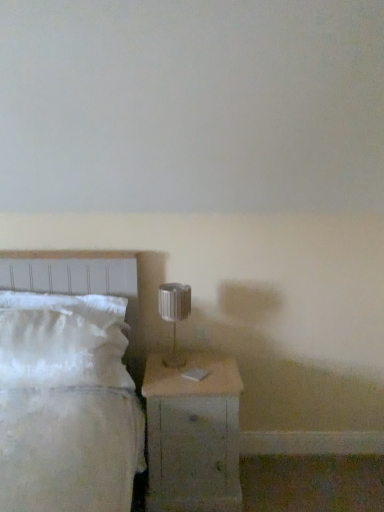
Looking at this image, in order to face white fluffy pillow at left, should I rotate leftwards or rightwards?

You should rotate left by 16.850 degrees.

Identify the location of white soft bed at left. (83, 284).

From the image's perspective, is wooden nightstand at lower right above or below white soft bed at left?

wooden nightstand at lower right is below white soft bed at left.

Can you confirm if wooden nightstand at lower right is positioned to the right of white soft bed at left?

Correct, you'll find wooden nightstand at lower right to the right of white soft bed at left.

Is wooden nightstand at lower right inside or outside of white soft bed at left?

The correct answer is: outside.

What are the coordinates of `bed above the wooden nightstand at lower right (from a real-world perspective)` in the screenshot? It's located at (83, 284).

Is white soft bed at left oriented towards metallic silver table lamp at center?

No, white soft bed at left is not facing towards metallic silver table lamp at center.

How distant is white soft bed at left from metallic silver table lamp at center?

A distance of 14.48 inches exists between white soft bed at left and metallic silver table lamp at center.

Can you confirm if white soft bed at left is bigger than metallic silver table lamp at center?

Indeed, white soft bed at left has a larger size compared to metallic silver table lamp at center.

From a real-world perspective, is white soft bed at left physically below metallic silver table lamp at center?

Yes, from a real-world perspective, white soft bed at left is beneath metallic silver table lamp at center.

Is metallic silver table lamp at center positioned in front of white soft bed at left?

That is False.

From a real-world perspective, is metallic silver table lamp at center located higher than white soft bed at left?

Yes, from a real-world perspective, metallic silver table lamp at center is on top of white soft bed at left.

Which of these two, metallic silver table lamp at center or white soft bed at left, is wider?

white soft bed at left.

Is white soft bed at left surrounded by metallic silver table lamp at center?

That's incorrect, white soft bed at left is not inside metallic silver table lamp at center.

Is there a large distance between white fluffy pillow at left and metallic silver table lamp at center?

No, white fluffy pillow at left is not far from metallic silver table lamp at center.

Considering the sizes of white fluffy pillow at left and metallic silver table lamp at center in the image, is white fluffy pillow at left wider or thinner than metallic silver table lamp at center?

Clearly, white fluffy pillow at left has more width compared to metallic silver table lamp at center.

From the image's perspective, is white fluffy pillow at left above or below metallic silver table lamp at center?

Clearly, from the image's perspective, white fluffy pillow at left is below metallic silver table lamp at center.

Is point (177, 372) closer to viewer compared to point (174, 364)?

Yes, it is.

Is wooden nightstand at lower right inside or outside of metallic silver table lamp at center?

wooden nightstand at lower right lies outside metallic silver table lamp at center.

Who is shorter, wooden nightstand at lower right or metallic silver table lamp at center?

metallic silver table lamp at center.

Which object is further away from the camera taking this photo, wooden nightstand at lower right or metallic silver table lamp at center?

metallic silver table lamp at center is behind.

Is point (194, 396) farther from camera compared to point (33, 385)?

That is True.

In the scene shown: Is wooden nightstand at lower right positioned with its back to white fluffy pillow at left?

wooden nightstand at lower right does not have its back to white fluffy pillow at left.

The height and width of the screenshot is (512, 384). In order to click on nightstand that is in front of the white fluffy pillow at left in this screenshot , I will do `click(193, 435)`.

From the image's perspective, which is above, wooden nightstand at lower right or white fluffy pillow at left?

From the image's view, white fluffy pillow at left is above.

This screenshot has width=384, height=512. Identify the location of bed in front of the wooden nightstand at lower right. (83, 284).

Is white soft bed at left at the right side of wooden nightstand at lower right?

No.

Is point (27, 263) behind point (161, 493)?

Yes, it is.

The height and width of the screenshot is (512, 384). Identify the location of nightstand below the white soft bed at left (from a real-world perspective). (193, 435).

Locate an element on the screen. Image resolution: width=384 pixels, height=512 pixels. table lamp behind the white soft bed at left is located at coordinates (174, 315).

From the image, which object appears to be nearer to wooden nightstand at lower right, white soft bed at left or white fluffy pillow at left?

white fluffy pillow at left.

Based on their spatial positions, is white soft bed at left or white fluffy pillow at left further from metallic silver table lamp at center?

white fluffy pillow at left.

Estimate the real-world distances between objects in this image. Which object is closer to wooden nightstand at lower right, metallic silver table lamp at center or white fluffy pillow at left?

metallic silver table lamp at center is positioned closer to the anchor wooden nightstand at lower right.

Looking at the image, which one is located further to metallic silver table lamp at center, white fluffy pillow at left or white soft bed at left?

white fluffy pillow at left.

Based on their spatial positions, is wooden nightstand at lower right or white soft bed at left further from metallic silver table lamp at center?

white soft bed at left is positioned further to the anchor metallic silver table lamp at center.

When comparing their distances from white fluffy pillow at left, does white soft bed at left or wooden nightstand at lower right seem closer?

Based on the image, white soft bed at left appears to be nearer to white fluffy pillow at left.

Considering their positions, is metallic silver table lamp at center positioned closer to white soft bed at left than wooden nightstand at lower right?

metallic silver table lamp at center is closer to white soft bed at left.

Looking at the image, which one is located further to white fluffy pillow at left, white soft bed at left or metallic silver table lamp at center?

Among the two, metallic silver table lamp at center is located further to white fluffy pillow at left.

Locate an element on the screen. bed located between white fluffy pillow at left and metallic silver table lamp at center in the left-right direction is located at coordinates click(83, 284).

This screenshot has width=384, height=512. In order to click on table lamp situated between white fluffy pillow at left and wooden nightstand at lower right from left to right in this screenshot , I will do `click(174, 315)`.

Where is `bed between white fluffy pillow at left and wooden nightstand at lower right in the horizontal direction`? The image size is (384, 512). bed between white fluffy pillow at left and wooden nightstand at lower right in the horizontal direction is located at coordinates (83, 284).

Where is `table lamp located between white soft bed at left and wooden nightstand at lower right in the left-right direction`? table lamp located between white soft bed at left and wooden nightstand at lower right in the left-right direction is located at coordinates (174, 315).